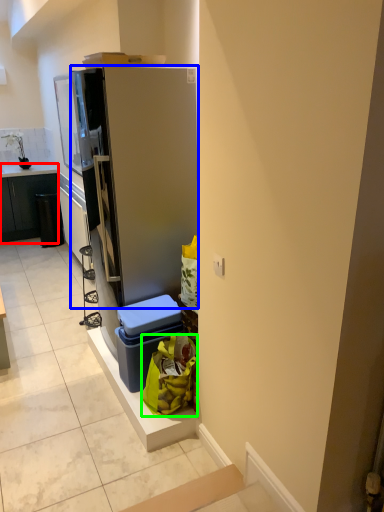
Question: Estimate the real-world distances between objects in this image. Which object is farther from cabinetry (highlighted by a red box), refrigerator (highlighted by a blue box) or garbage (highlighted by a green box)?

Choices:
 (A) refrigerator
 (B) garbage

Answer: (B)